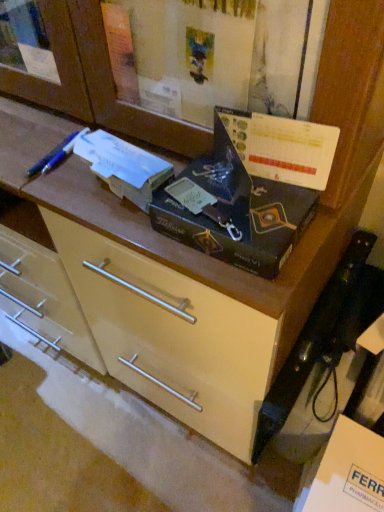
Question: Can you confirm if blue plastic pen at upper left is bigger than matte black box at center?

Choices:
 (A) yes
 (B) no

Answer: (B)

Question: Does blue plastic pen at upper left turn towards matte black box at center?

Choices:
 (A) yes
 (B) no

Answer: (B)

Question: Is blue plastic pen at upper left positioned in front of matte black box at center?

Choices:
 (A) no
 (B) yes

Answer: (A)

Question: From the image's perspective, is blue plastic pen at upper left under matte black box at center?

Choices:
 (A) yes
 (B) no

Answer: (B)

Question: Is matte black box at center located within blue plastic pen at upper left?

Choices:
 (A) yes
 (B) no

Answer: (B)

Question: Is matte black box at center in front of or behind matte cream drawer at center in the image?

Choices:
 (A) behind
 (B) front

Answer: (B)

Question: From a real-world perspective, is matte black box at center physically located above or below matte cream drawer at center?

Choices:
 (A) below
 (B) above

Answer: (B)

Question: Is matte black box at center spatially inside matte cream drawer at center, or outside of it?

Choices:
 (A) outside
 (B) inside

Answer: (A)

Question: Looking at the image, does matte black box at center seem bigger or smaller compared to matte cream drawer at center?

Choices:
 (A) small
 (B) big

Answer: (A)

Question: From the image's perspective, is blue plastic pen at upper left located above or below matte cream drawer at center?

Choices:
 (A) above
 (B) below

Answer: (A)

Question: From a real-world perspective, is blue plastic pen at upper left above or below matte cream drawer at center?

Choices:
 (A) above
 (B) below

Answer: (A)

Question: Is blue plastic pen at upper left wider or thinner than matte cream drawer at center?

Choices:
 (A) wide
 (B) thin

Answer: (B)

Question: Is point (41, 166) closer or farther from the camera than point (218, 431)?

Choices:
 (A) farther
 (B) closer

Answer: (B)

Question: In terms of height, does matte cream drawer at center look taller or shorter compared to blue plastic pen at upper left?

Choices:
 (A) tall
 (B) short

Answer: (A)

Question: Based on their positions, is matte cream drawer at center located to the left or right of blue plastic pen at upper left?

Choices:
 (A) right
 (B) left

Answer: (A)